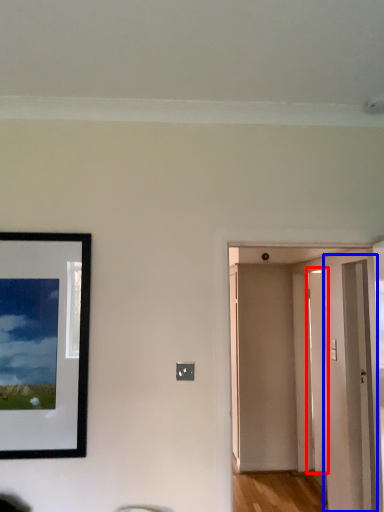
Question: Which object appears closest to the camera in this image, door (highlighted by a red box) or glass door (highlighted by a blue box)?

Choices:
 (A) door
 (B) glass door

Answer: (B)